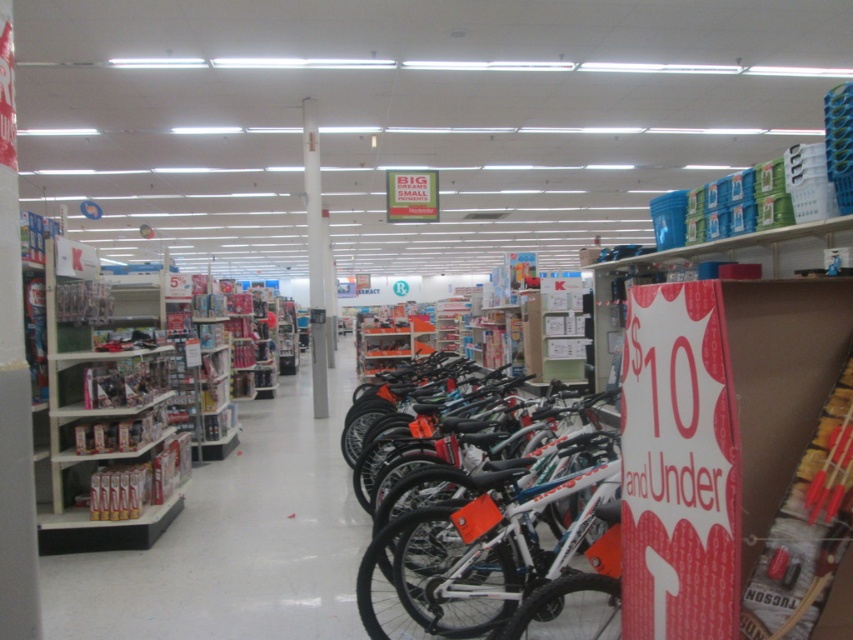
Question: Is white smooth pillar at center to the left of white glossy pillar at center from the viewer's perspective?

Choices:
 (A) yes
 (B) no

Answer: (B)

Question: Which point is farther to the camera?

Choices:
 (A) (308, 170)
 (B) (38, 604)

Answer: (A)

Question: Is white smooth pillar at center above white glossy pillar at center?

Choices:
 (A) yes
 (B) no

Answer: (B)

Question: Which point is farther to the camera?

Choices:
 (A) (318, 416)
 (B) (492, 616)

Answer: (A)

Question: Which point is closer to the camera taking this photo?

Choices:
 (A) (561, 564)
 (B) (12, 112)

Answer: (B)

Question: Does white matte bicycle at center appear over white glossy pillar at center?

Choices:
 (A) yes
 (B) no

Answer: (B)